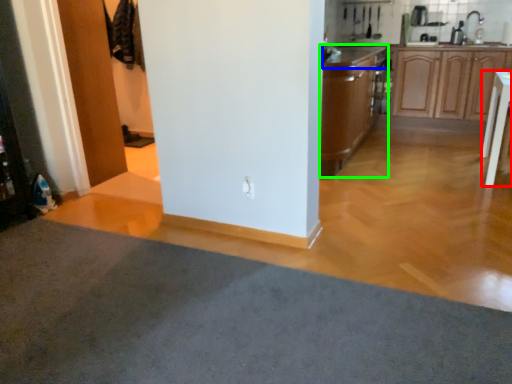
Question: Estimate the real-world distances between objects in this image. Which object is closer to table (highlighted by a red box), countertop (highlighted by a blue box) or cabinetry (highlighted by a green box)?

Choices:
 (A) countertop
 (B) cabinetry

Answer: (B)